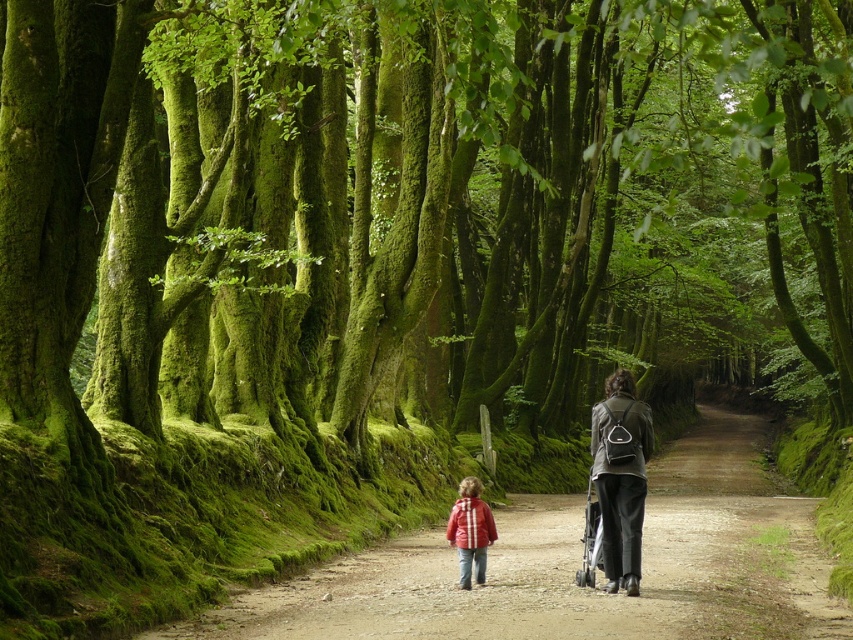
Who is higher up, dirt path at center or matte black backpack at center?

matte black backpack at center is above.

Does point (405, 604) come farther from viewer compared to point (640, 454)?

No, (405, 604) is closer to viewer.

The height and width of the screenshot is (640, 853). Describe the element at coordinates (576, 564) in the screenshot. I see `dirt path at center` at that location.

Identify the location of dirt path at center. The image size is (853, 640). (576, 564).

Who is positioned more to the left, dirt path at center or red plaid jacket at center?

Positioned to the left is red plaid jacket at center.

Can you confirm if dirt path at center is taller than red plaid jacket at center?

Yes, dirt path at center is taller than red plaid jacket at center.

Who is more forward, (677, 584) or (477, 481)?

Point (677, 584)

You are a GUI agent. You are given a task and a screenshot of the screen. Output one action in this format:
    pyautogui.click(x=<x>, y=<y>)
    Task: Click on the dirt path at center
    This screenshot has width=853, height=640.
    Given the screenshot: What is the action you would take?
    pyautogui.click(x=576, y=564)

Does red plaid jacket at center have a greater width compared to black plastic baby carriage at center?

No, red plaid jacket at center is not wider than black plastic baby carriage at center.

Is red plaid jacket at center in front of black plastic baby carriage at center?

That is False.

This screenshot has width=853, height=640. What do you see at coordinates (469, 531) in the screenshot?
I see `red plaid jacket at center` at bounding box center [469, 531].

The height and width of the screenshot is (640, 853). What are the coordinates of `red plaid jacket at center` in the screenshot? It's located at (469, 531).